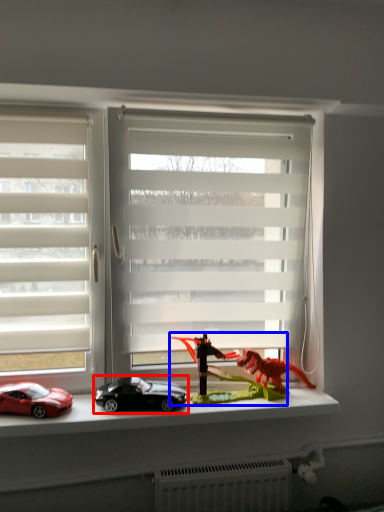
Question: Which point is closer to the camera, car (highlighted by a red box) or toy (highlighted by a blue box)?

Choices:
 (A) car
 (B) toy

Answer: (A)